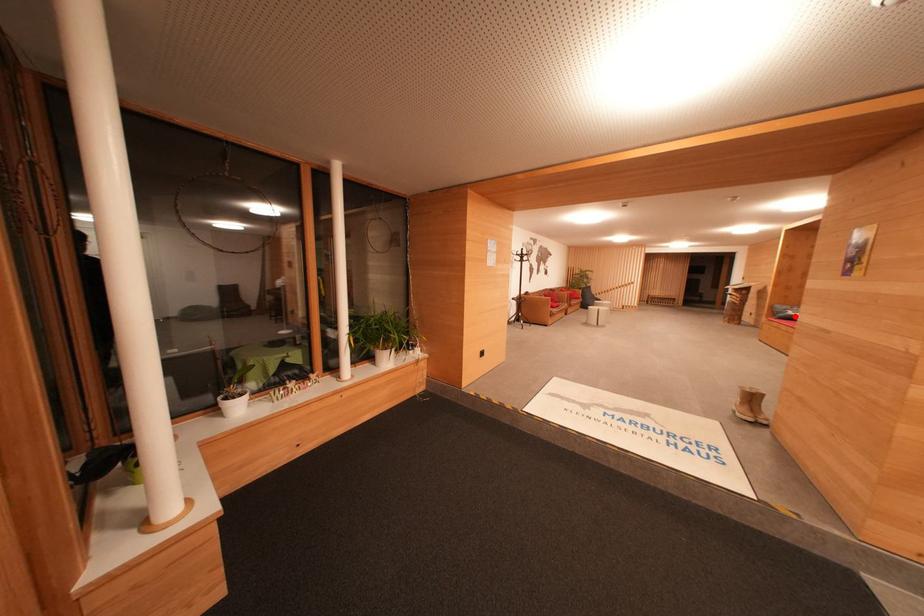
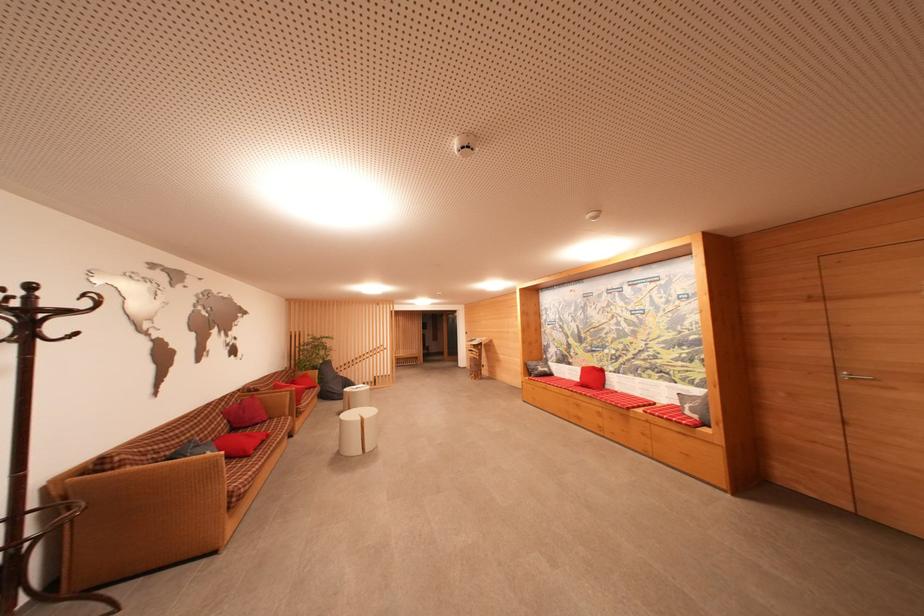
Locate, in the second image, the point that corresponds to the highlighted location in the first image.

(544, 371)